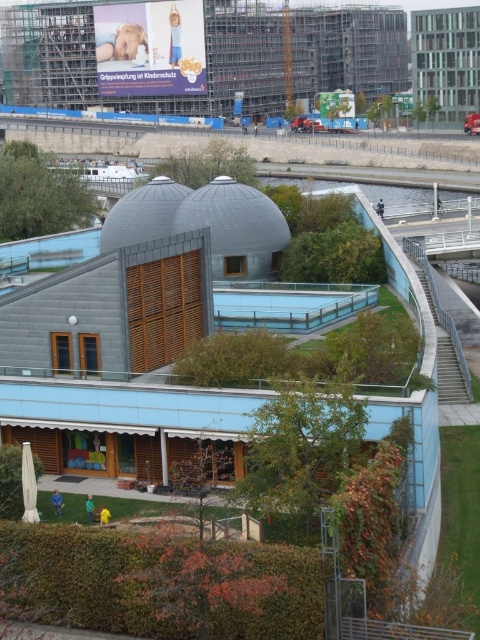
Does green leafy hedge at center have a smaller size compared to green leafy hedge at upper center?

Indeed, green leafy hedge at center has a smaller size compared to green leafy hedge at upper center.

Who is shorter, green leafy hedge at center or green leafy hedge at upper center?

Standing shorter between the two is green leafy hedge at center.

Between point (342, 272) and point (194, 161), which one is positioned behind?

The point (194, 161) is more distant.

I want to click on green leafy hedge at center, so (x=335, y=257).

How far apart are green leafy hedge at left and green leafy hedge at upper center?

green leafy hedge at left and green leafy hedge at upper center are 39.76 feet apart from each other.

What do you see at coordinates (39, 193) in the screenshot? The height and width of the screenshot is (640, 480). I see `green leafy hedge at left` at bounding box center [39, 193].

Is point (19, 173) behind point (223, 140)?

No, (19, 173) is in front of (223, 140).

The width and height of the screenshot is (480, 640). Find the location of `green leafy hedge at left`. green leafy hedge at left is located at coordinates (39, 193).

Between brown textured hedge at lower center and green leafy hedge at upper center, which one has more height?

green leafy hedge at upper center

Is point (129, 563) in front of point (180, 170)?

That is True.

Is point (206, 605) positioned behind point (181, 157)?

No, (206, 605) is closer to viewer.

This screenshot has width=480, height=640. In order to click on brown textured hedge at lower center in this screenshot , I will do `click(160, 582)`.